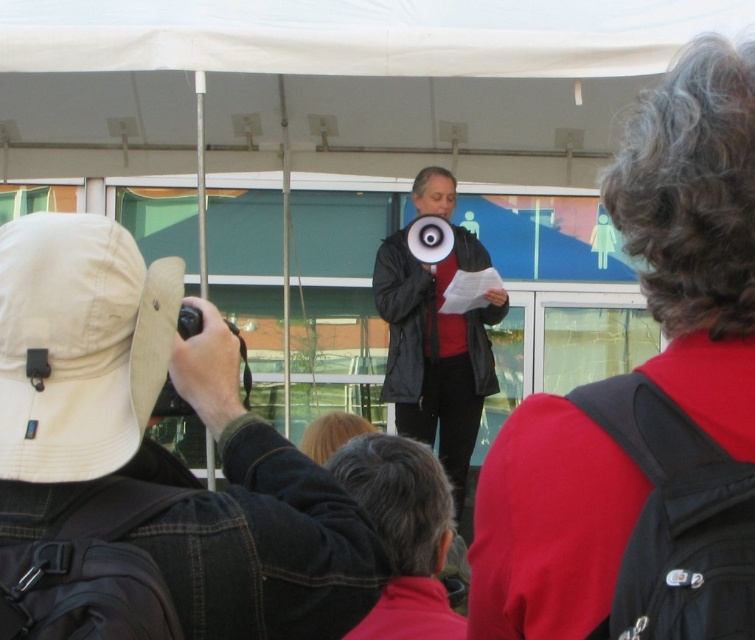
You are a photographer at the event and want to capture a photo that includes both the tan fabric hat at upper left and the black matte jacket at center. Which object should you position at the top of your camera frame?

The tan fabric hat at upper left should be positioned at the top of the camera frame since it is above the black matte jacket at center.

You are at the event and want to locate the tan fabric hat at upper left. Where exactly is it positioned in the image?

The tan fabric hat at upper left is located at point coordinates of 0.727 in the x axis and 0.199 in the y axis.

You are a photographer at the event and want to capture the black matte jacket at center while also including the tan fabric hat at upper left in the shot. Can you position yourself in a way that both objects are visible in your camera frame?

Yes, the tan fabric hat at upper left is to the left of the black matte jacket at center, so positioning yourself to the left of both objects or centering your frame between them would allow both to be visible.